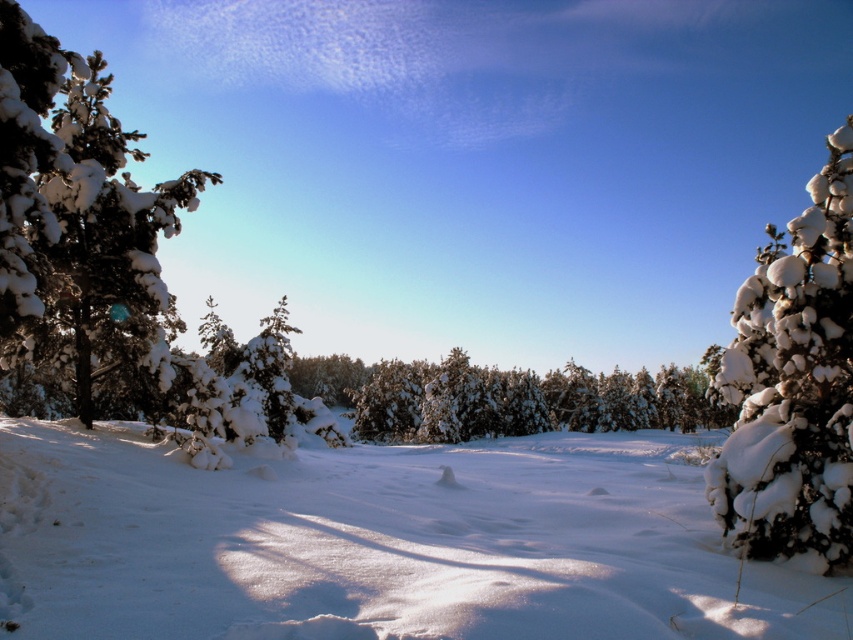
Question: Which object appears closest to the camera in this image?

Choices:
 (A) white fluffy snow-covered tree at left
 (B) white fluffy snow at center

Answer: (B)

Question: Which point appears closest to the camera in this image?

Choices:
 (A) (74, 632)
 (B) (3, 148)

Answer: (A)

Question: Can you confirm if white fluffy snow at center is positioned to the left of white fluffy snow-covered tree at left?

Choices:
 (A) yes
 (B) no

Answer: (B)

Question: Can you confirm if white fluffy snow at center is wider than white fluffy snow-covered tree at left?

Choices:
 (A) yes
 (B) no

Answer: (B)

Question: Is white fluffy snow at center further to the viewer compared to white fluffy snow-covered tree at left?

Choices:
 (A) no
 (B) yes

Answer: (A)

Question: Which point is farther from the camera taking this photo?

Choices:
 (A) (798, 376)
 (B) (242, 468)

Answer: (B)